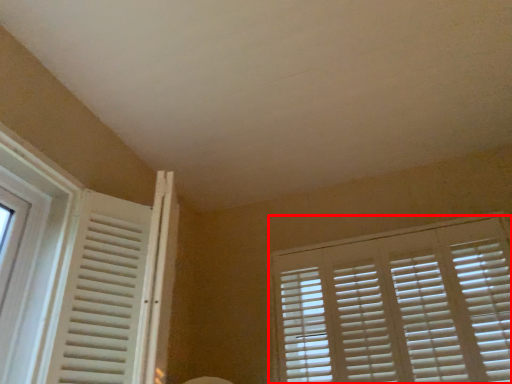
Question: From the image, what is the correct spatial relationship of window blind (annotated by the red box) in relation to window?

Choices:
 (A) left
 (B) right

Answer: (B)